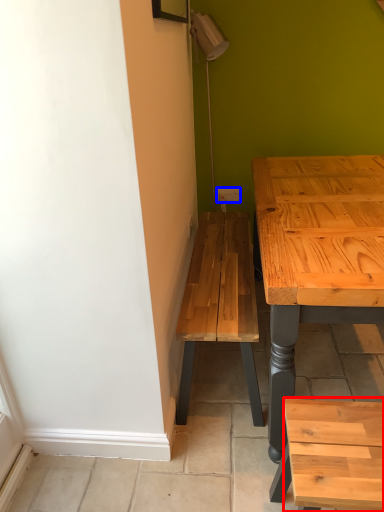
Question: Among these objects, which one is farthest to the camera, stool (highlighted by a red box) or electric outlet (highlighted by a blue box)?

Choices:
 (A) stool
 (B) electric outlet

Answer: (B)